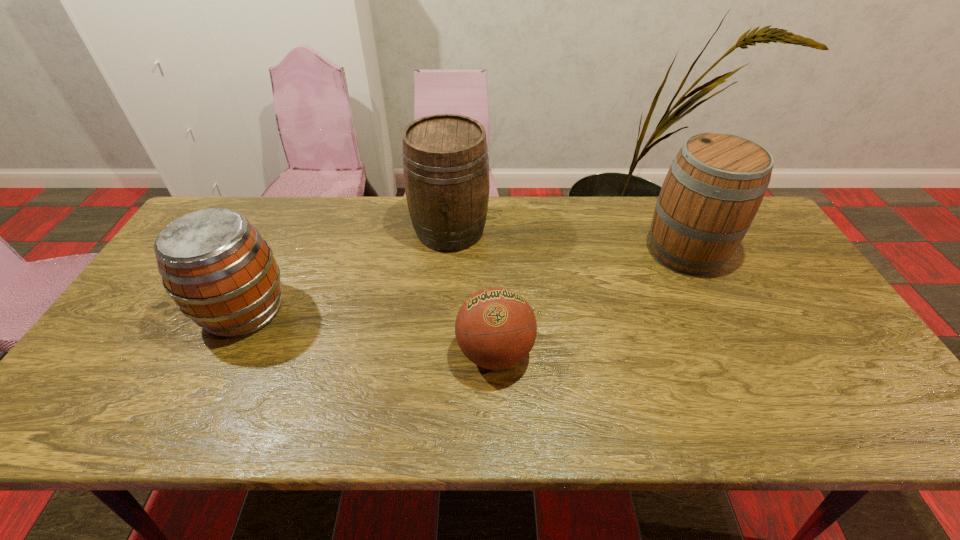
Locate an element on the screen. This screenshot has width=960, height=540. the second cider from right to left is located at coordinates (445, 156).

This screenshot has height=540, width=960. What are the coordinates of `the rightmost object` in the screenshot? It's located at (715, 185).

Locate an element on the screen. the third tallest object is located at coordinates (220, 272).

At what (x,y) coordinates should I click in order to perform the action: click on the leftmost cider. Please return your answer as a coordinate pair (x, y). This screenshot has height=540, width=960. Looking at the image, I should click on [x=220, y=272].

In order to click on basketball in this screenshot , I will do `click(495, 328)`.

Where is `vacant area situated on the side of the second cider from left to right near the bung hole`? This screenshot has height=540, width=960. vacant area situated on the side of the second cider from left to right near the bung hole is located at coordinates click(x=447, y=269).

Locate an element on the screen. This screenshot has width=960, height=540. vacant space located on the front of the rightmost object is located at coordinates (758, 398).

Where is `free space located 0.320m on the back of the third tallest object`? free space located 0.320m on the back of the third tallest object is located at coordinates (294, 211).

This screenshot has width=960, height=540. In order to click on free location located 0.310m on the back of the basketball in this screenshot , I will do `click(492, 244)`.

You are a GUI agent. You are given a task and a screenshot of the screen. Output one action in this format:
    pyautogui.click(x=<x>, y=<y>)
    Task: Click on the free region at the far edge of the desktop
    The height and width of the screenshot is (540, 960).
    Given the screenshot: What is the action you would take?
    pyautogui.click(x=523, y=208)